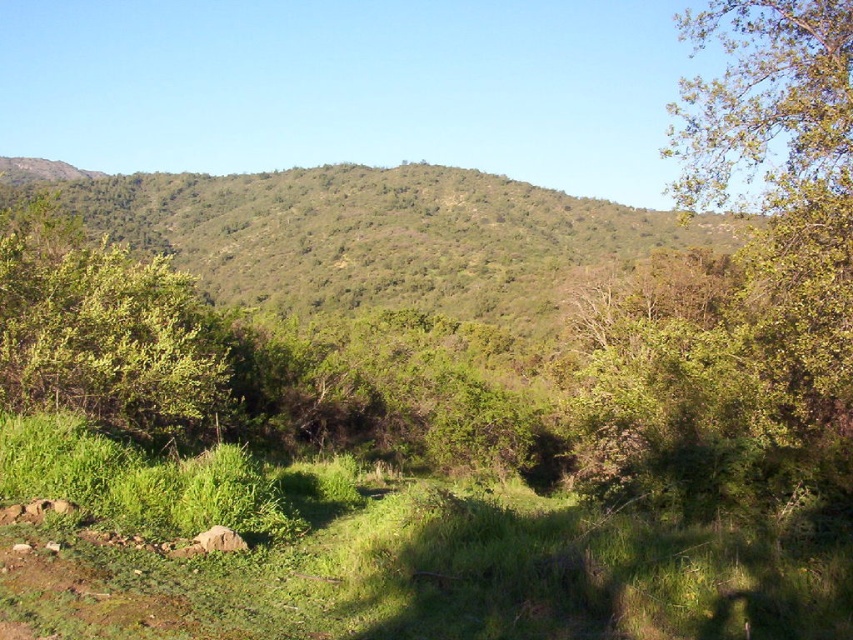
Question: Can you confirm if green leafy hillside at center is positioned below green leafy bush at left?

Choices:
 (A) no
 (B) yes

Answer: (A)

Question: Is green leafy hillside at center closer to camera compared to green leafy bush at left?

Choices:
 (A) no
 (B) yes

Answer: (A)

Question: Does green leafy hillside at center have a larger size compared to green leafy bush at left?

Choices:
 (A) yes
 (B) no

Answer: (A)

Question: Which point is farther to the camera?

Choices:
 (A) green leafy bush at left
 (B) green leafy hillside at center

Answer: (B)

Question: Which point is closer to the camera?

Choices:
 (A) (54, 392)
 (B) (328, 216)

Answer: (A)